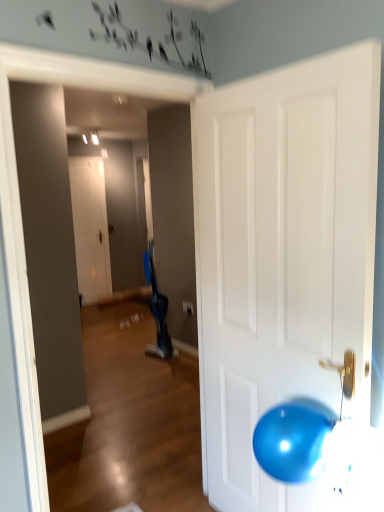
In order to click on white matte door at center, which is the second door in front-to-back order in this screenshot , I will do `click(90, 227)`.

What do you see at coordinates (90, 227) in the screenshot?
I see `white matte door at center, placed as the 1th door when sorted from left to right` at bounding box center [90, 227].

The image size is (384, 512). What do you see at coordinates (282, 252) in the screenshot? I see `glossy white door at right, which ranks as the first door in right-to-left order` at bounding box center [282, 252].

Locate an element on the screen. glossy white door at right, the second door from the left is located at coordinates (282, 252).

The width and height of the screenshot is (384, 512). Find the location of `white matte door at center, the first door positioned from the back`. white matte door at center, the first door positioned from the back is located at coordinates (90, 227).

Would you say white matte door at center, arranged as the second door when viewed from the right, is to the left or to the right of glossy white door at right, which ranks as the first door in right-to-left order, in the picture?

In the image, white matte door at center, arranged as the second door when viewed from the right, appears on the left side of glossy white door at right, which ranks as the first door in right-to-left order.

Is white matte door at center, arranged as the second door when viewed from the right, further to camera compared to glossy white door at right, which ranks as the first door in right-to-left order?

Yes, white matte door at center, arranged as the second door when viewed from the right, is further from the viewer.

Which is nearer, (x=94, y=300) or (x=223, y=353)?

Point (x=94, y=300) is farther from the camera than point (x=223, y=353).

Looking at this image, from the image's perspective, relative to glossy white door at right, which ranks as the first door in right-to-left order, is white matte door at center, arranged as the second door when viewed from the right, above or below?

white matte door at center, arranged as the second door when viewed from the right, is situated higher than glossy white door at right, which ranks as the first door in right-to-left order, in the image.

From a real-world perspective, is white matte door at center, arranged as the second door when viewed from the right, physically above glossy white door at right, the second door from the left?

Indeed, from a real-world perspective, white matte door at center, arranged as the second door when viewed from the right, stands above glossy white door at right, the second door from the left.

Considering the sizes of white matte door at center, the first door positioned from the back, and glossy white door at right, the second door from the left, in the image, is white matte door at center, the first door positioned from the back, wider or thinner than glossy white door at right, the second door from the left,?

white matte door at center, the first door positioned from the back, is thinner than glossy white door at right, the second door from the left.

Is white matte door at center, the first door positioned from the back, shorter than glossy white door at right, which ranks as the first door in right-to-left order?

In fact, white matte door at center, the first door positioned from the back, may be taller than glossy white door at right, which ranks as the first door in right-to-left order.

Looking at the image, does white matte door at center, the first door positioned from the back, seem bigger or smaller compared to glossy white door at right, the 1th door positioned from the front?

Clearly, white matte door at center, the first door positioned from the back, is smaller in size than glossy white door at right, the 1th door positioned from the front.

Can glossy white door at right, positioned as the 2th door in back-to-front order, be found inside white matte door at center, which is the second door in front-to-back order?

Actually, glossy white door at right, positioned as the 2th door in back-to-front order, is outside white matte door at center, which is the second door in front-to-back order.

Is white matte door at center, placed as the 1th door when sorted from left to right, touching glossy white door at right, the second door from the left?

There is a gap between white matte door at center, placed as the 1th door when sorted from left to right, and glossy white door at right, the second door from the left.

Could you tell me if white matte door at center, the first door positioned from the back, is facing glossy white door at right, the 1th door positioned from the front?

No, white matte door at center, the first door positioned from the back, is not turned towards glossy white door at right, the 1th door positioned from the front.

Can you tell me how much white matte door at center, placed as the 1th door when sorted from left to right, and glossy white door at right, which ranks as the first door in right-to-left order, differ in facing direction?

90.8 degrees separate the facing orientations of white matte door at center, placed as the 1th door when sorted from left to right, and glossy white door at right, which ranks as the first door in right-to-left order.

The height and width of the screenshot is (512, 384). In order to click on door below the white matte door at center, placed as the 1th door when sorted from left to right (from a real-world perspective) in this screenshot , I will do `click(282, 252)`.

Considering the positions of objects glossy white door at right, the second door from the left, and white matte door at center, placed as the 1th door when sorted from left to right, in the image provided, who is more to the right, glossy white door at right, the second door from the left, or white matte door at center, placed as the 1th door when sorted from left to right,?

From the viewer's perspective, glossy white door at right, the second door from the left, appears more on the right side.

Is the position of glossy white door at right, which ranks as the first door in right-to-left order, more distant than that of white matte door at center, the first door positioned from the back?

No, the depth of glossy white door at right, which ranks as the first door in right-to-left order, is less than that of white matte door at center, the first door positioned from the back.

Does point (337, 295) appear closer or farther from the camera than point (103, 186)?

Point (337, 295) appears to be closer to the viewer than point (103, 186).

From the image's perspective, is glossy white door at right, positioned as the 2th door in back-to-front order, located above white matte door at center, the first door positioned from the back?

Actually, glossy white door at right, positioned as the 2th door in back-to-front order, appears below white matte door at center, the first door positioned from the back, in the image.

From a real-world perspective, between glossy white door at right, positioned as the 2th door in back-to-front order, and white matte door at center, arranged as the second door when viewed from the right, who is vertically higher?

white matte door at center, arranged as the second door when viewed from the right, is physically above.

Considering the sizes of objects glossy white door at right, the 1th door positioned from the front, and white matte door at center, arranged as the second door when viewed from the right, in the image provided, who is wider, glossy white door at right, the 1th door positioned from the front, or white matte door at center, arranged as the second door when viewed from the right,?

glossy white door at right, the 1th door positioned from the front, is wider.

Who is taller, glossy white door at right, positioned as the 2th door in back-to-front order, or white matte door at center, arranged as the second door when viewed from the right?

Standing taller between the two is white matte door at center, arranged as the second door when viewed from the right.

Can you confirm if glossy white door at right, positioned as the 2th door in back-to-front order, is bigger than white matte door at center, arranged as the second door when viewed from the right?

Correct, glossy white door at right, positioned as the 2th door in back-to-front order, is larger in size than white matte door at center, arranged as the second door when viewed from the right.

Is glossy white door at right, the 1th door positioned from the front, completely or partially outside of white matte door at center, arranged as the second door when viewed from the right?

That's correct, glossy white door at right, the 1th door positioned from the front, is outside of white matte door at center, arranged as the second door when viewed from the right.

Is glossy white door at right, positioned as the 2th door in back-to-front order, beside white matte door at center, the first door positioned from the back?

There is a gap between glossy white door at right, positioned as the 2th door in back-to-front order, and white matte door at center, the first door positioned from the back.

Is glossy white door at right, the 1th door positioned from the front, turned away from white matte door at center, which is the second door in front-to-back order?

No, white matte door at center, which is the second door in front-to-back order, is not at the back of glossy white door at right, the 1th door positioned from the front.

Can you tell me how much glossy white door at right, which ranks as the first door in right-to-left order, and white matte door at center, placed as the 1th door when sorted from left to right, differ in facing direction?

The angular difference between glossy white door at right, which ranks as the first door in right-to-left order, and white matte door at center, placed as the 1th door when sorted from left to right, is 90.8 degrees.

Identify the location of door on the right of white matte door at center, arranged as the second door when viewed from the right. The height and width of the screenshot is (512, 384). (282, 252).

Identify the location of door that appears on the right of white matte door at center, the first door positioned from the back. (282, 252).

The height and width of the screenshot is (512, 384). I want to click on door that appears behind the glossy white door at right, the second door from the left, so click(90, 227).